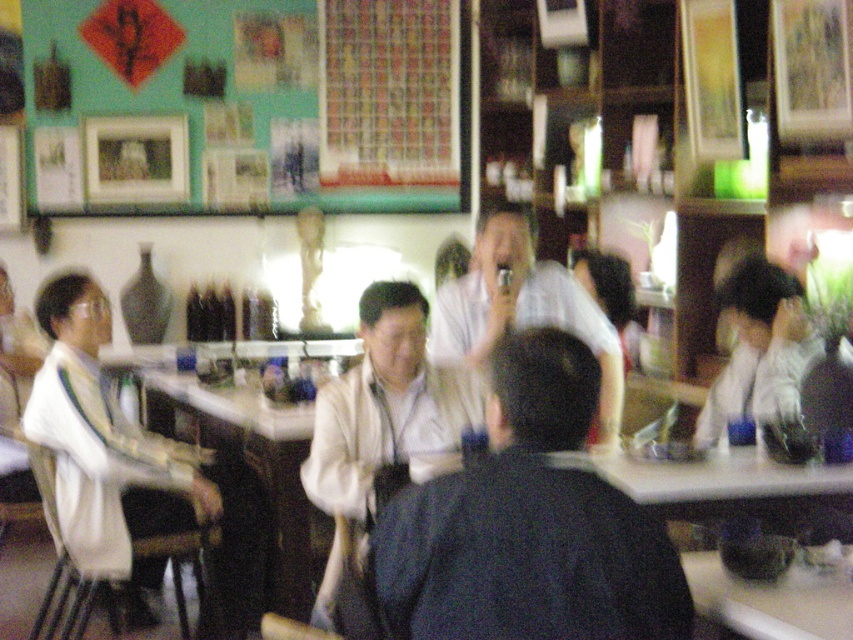
Question: Considering the relative positions of white glossy shirt at center and white glossy table at lower right in the image provided, where is white glossy shirt at center located with respect to white glossy table at lower right?

Choices:
 (A) above
 (B) below

Answer: (A)

Question: Is white matte shirt at left to the right of white glossy shirt at center from the viewer's perspective?

Choices:
 (A) no
 (B) yes

Answer: (A)

Question: Which object appears farthest from the camera in this image?

Choices:
 (A) white matte jacket at center
 (B) dark blue shirt at center
 (C) white glossy table at lower right

Answer: (A)

Question: Is white matte jacket at center bigger than white glossy shirt at center?

Choices:
 (A) no
 (B) yes

Answer: (A)

Question: Among these objects, which one is farthest from the camera?

Choices:
 (A) white glossy shirt at center
 (B) white matte shirt at left
 (C) white glossy table at lower right
 (D) dark blue shirt at center

Answer: (B)

Question: Which point is closer to the camera?

Choices:
 (A) white matte jacket at center
 (B) white glossy table at lower right
 (C) white matte shirt at left
 (D) dark blue shirt at center

Answer: (D)